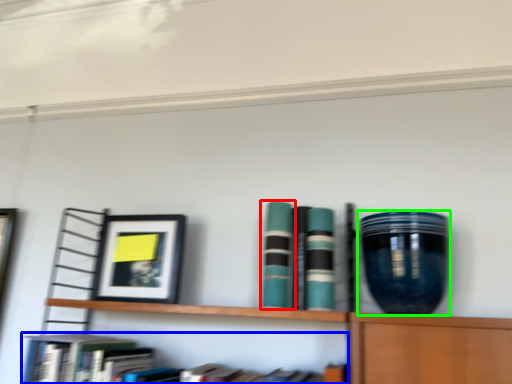
Question: Which is nearer to the book (highlighted by a red box)? book (highlighted by a blue box) or vase (highlighted by a green box).

Choices:
 (A) book
 (B) vase

Answer: (B)